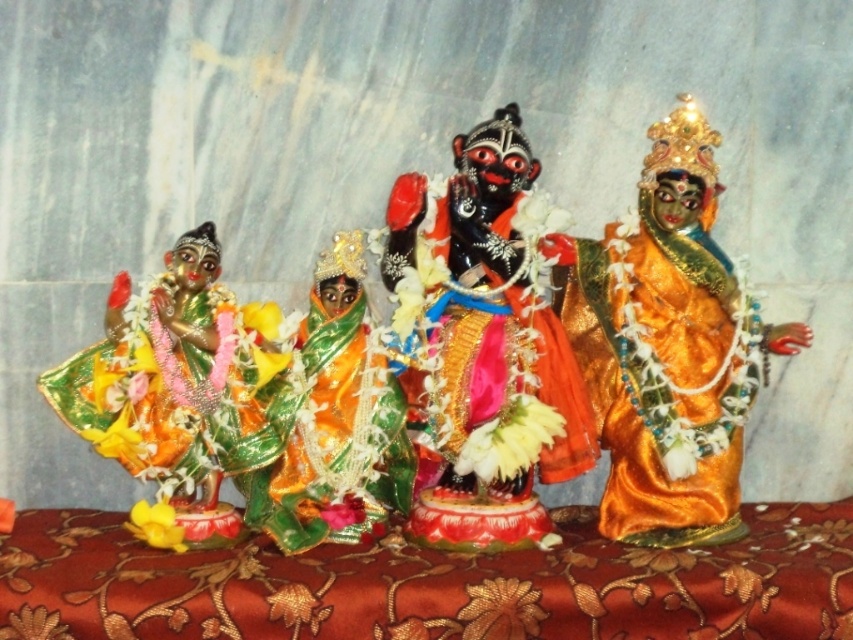
Where is `silky red cloth at center`? The width and height of the screenshot is (853, 640). silky red cloth at center is located at coordinates (431, 584).

Does silky red cloth at center appear on the left side of black glossy statue at center?

Yes, silky red cloth at center is to the left of black glossy statue at center.

Between point (248, 552) and point (544, 374), which one is positioned in front?

Positioned in front is point (248, 552).

This screenshot has height=640, width=853. I want to click on silky red cloth at center, so click(431, 584).

The height and width of the screenshot is (640, 853). Describe the element at coordinates (431, 584) in the screenshot. I see `silky red cloth at center` at that location.

Between point (720, 586) and point (306, 330), which one is positioned behind?

Positioned behind is point (306, 330).

Where is `silky red cloth at center`? silky red cloth at center is located at coordinates (431, 584).

Consider the image. Which of these two, orange satin robe at right or shiny green fabric at left, stands shorter?

shiny green fabric at left is shorter.

Looking at this image, is orange satin robe at right above shiny green fabric at left?

Correct, orange satin robe at right is located above shiny green fabric at left.

This screenshot has height=640, width=853. I want to click on orange satin robe at right, so click(665, 376).

Identify the location of orange satin robe at right. (665, 376).